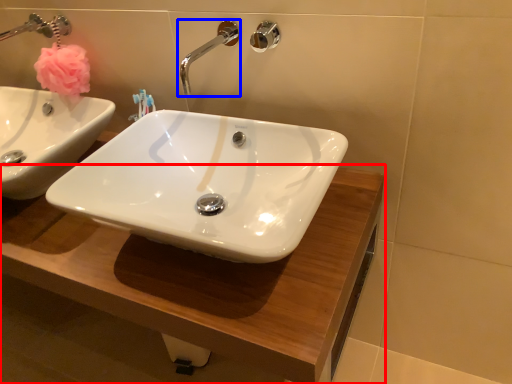
Question: Which object appears farthest to the camera in this image, counter top (highlighted by a red box) or tap (highlighted by a blue box)?

Choices:
 (A) counter top
 (B) tap

Answer: (B)